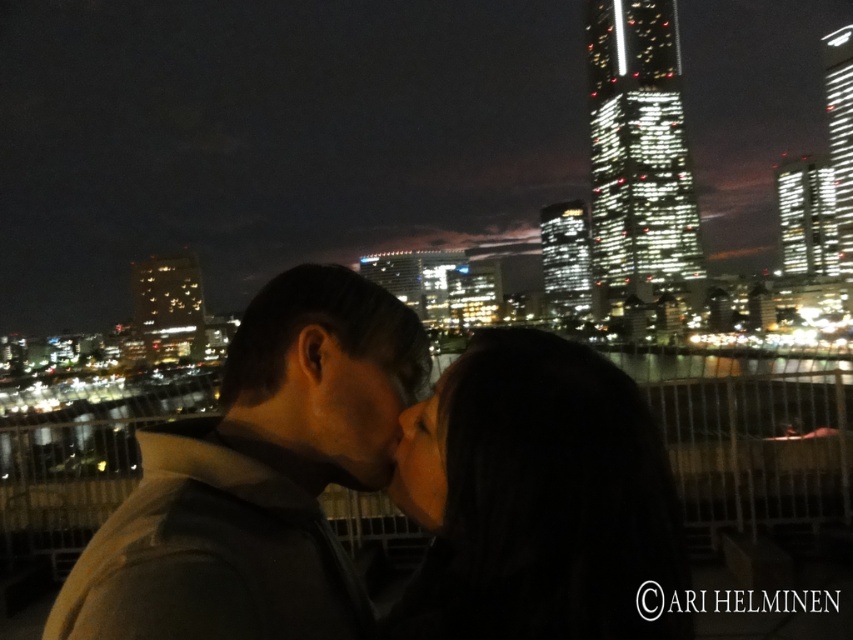
Who is more distant from viewer, (144, 506) or (527, 426)?

The point (527, 426) is behind.

Between dark brown leather jacket at center and dark hair at center, which one appears on the left side from the viewer's perspective?

dark brown leather jacket at center

Is point (310, 570) positioned in front of point (579, 628)?

No, (310, 570) is behind (579, 628).

Locate an element on the screen. Image resolution: width=853 pixels, height=640 pixels. dark brown leather jacket at center is located at coordinates (383, 484).